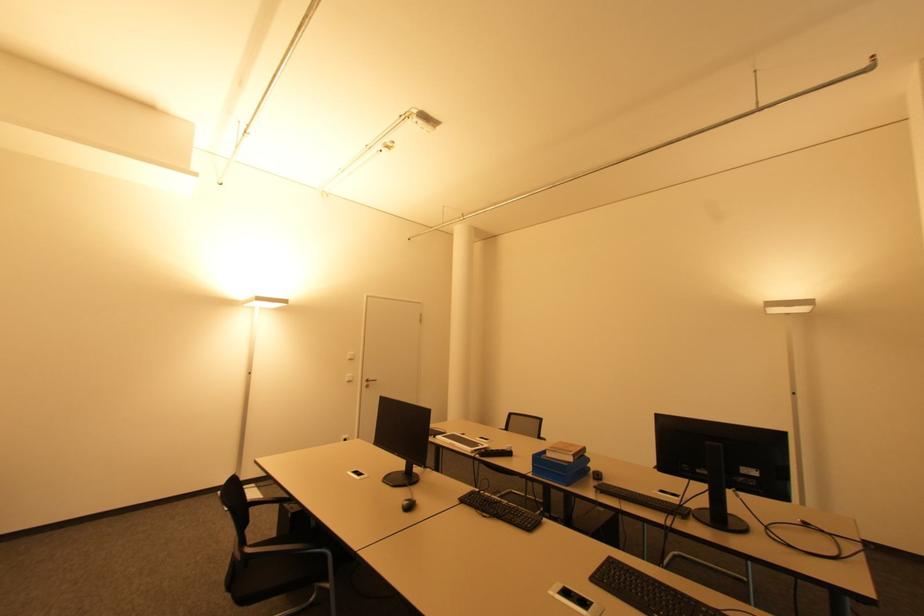
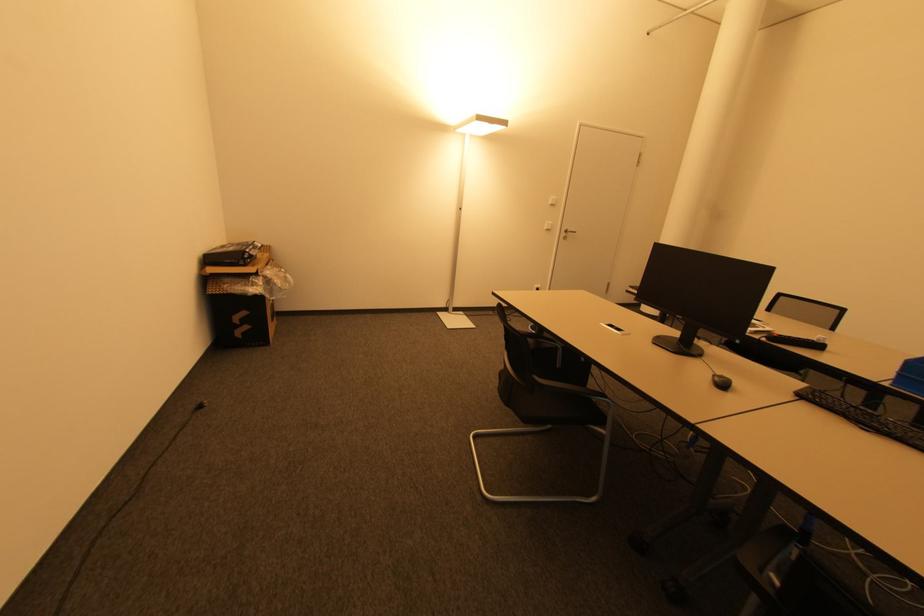
Locate, in the second image, the point that corresponds to (410,508) in the first image.

(725, 386)